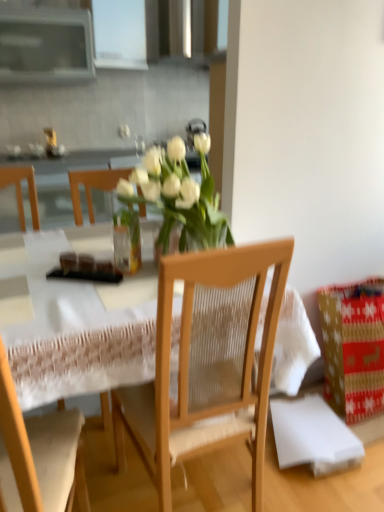
The image size is (384, 512). Identify the location of free spot in front of matte brown bread at table. (78, 285).